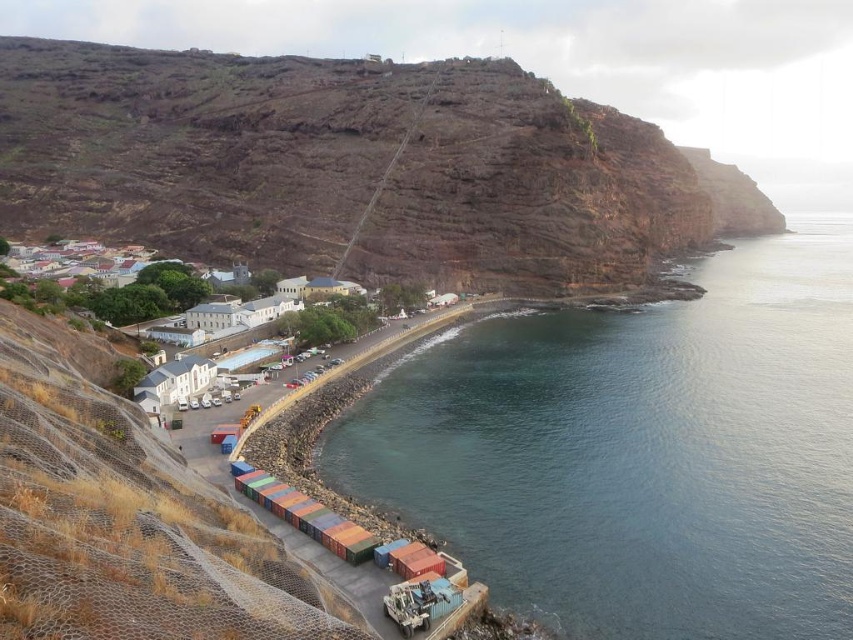
Which is in front, point (701, 531) or point (106, 48)?

Point (701, 531) is in front.

Is blue water at lower right bigger than brown rocky cliff at upper left?

No.

Is point (757, 456) positioned behind point (584, 259)?

No, (757, 456) is in front of (584, 259).

At what (x,y) coordinates should I click in order to perform the action: click on blue water at lower right. Please return your answer as a coordinate pair (x, y). The width and height of the screenshot is (853, 640). Looking at the image, I should click on (639, 451).